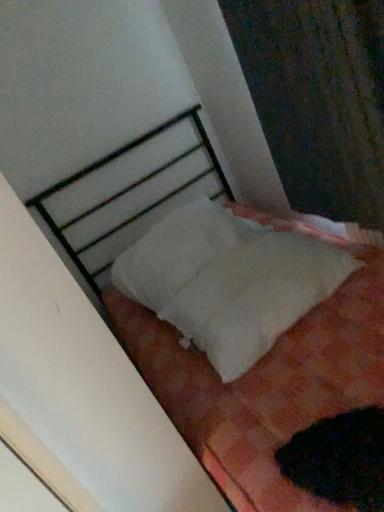
Question: From the image's perspective, is white fabric curtain at upper right under white soft pillow at center?

Choices:
 (A) yes
 (B) no

Answer: (B)

Question: Does white fabric curtain at upper right have a smaller size compared to white soft pillow at center?

Choices:
 (A) yes
 (B) no

Answer: (B)

Question: Is white fabric curtain at upper right far away from white soft pillow at center?

Choices:
 (A) yes
 (B) no

Answer: (B)

Question: From the image's perspective, is white fabric curtain at upper right over white soft pillow at center?

Choices:
 (A) yes
 (B) no

Answer: (A)

Question: From a real-world perspective, is white fabric curtain at upper right on white soft pillow at center?

Choices:
 (A) no
 (B) yes

Answer: (B)

Question: Is white fabric curtain at upper right thinner than white soft pillow at center?

Choices:
 (A) yes
 (B) no

Answer: (A)

Question: From the image's perspective, is white fabric curtain at upper right under white soft fabric at center?

Choices:
 (A) yes
 (B) no

Answer: (B)

Question: From a real-world perspective, is white fabric curtain at upper right located higher than white soft fabric at center?

Choices:
 (A) no
 (B) yes

Answer: (B)

Question: Can you confirm if white fabric curtain at upper right is positioned to the right of white soft fabric at center?

Choices:
 (A) no
 (B) yes

Answer: (B)

Question: Is white fabric curtain at upper right next to white soft fabric at center and touching it?

Choices:
 (A) no
 (B) yes

Answer: (A)

Question: Does white fabric curtain at upper right have a smaller size compared to white soft fabric at center?

Choices:
 (A) yes
 (B) no

Answer: (B)

Question: Is white fabric curtain at upper right outside white soft fabric at center?

Choices:
 (A) yes
 (B) no

Answer: (A)

Question: From a real-world perspective, does white soft pillow at center sit lower than black fuzzy cat at lower right?

Choices:
 (A) yes
 (B) no

Answer: (B)